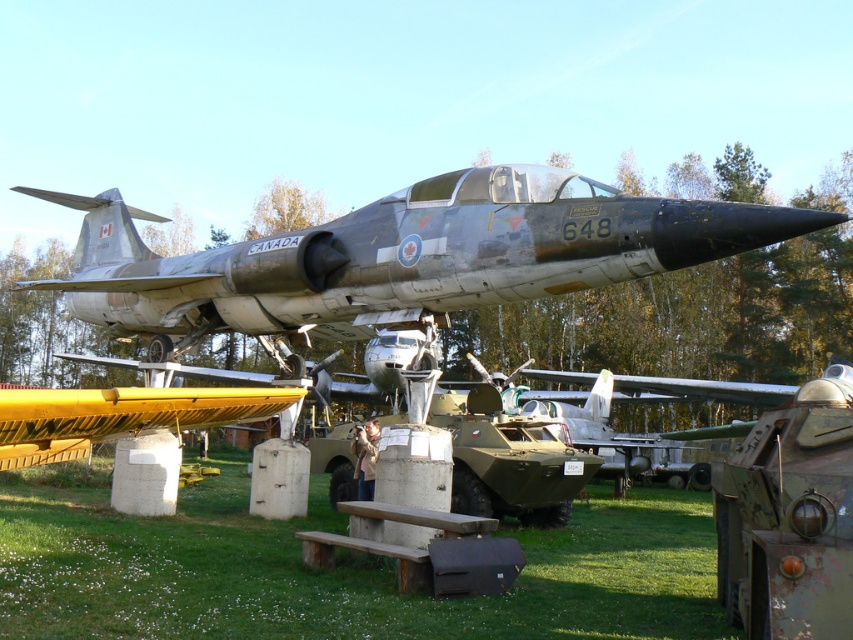
Question: Can you confirm if green grass at center is positioned to the right of camouflage paint fighter jet at center?

Choices:
 (A) no
 (B) yes

Answer: (A)

Question: Which point is farther to the camera?

Choices:
 (A) camouflage paint fighter jet at center
 (B) green grass at center

Answer: (A)

Question: From the image, what is the correct spatial relationship of green grass at center in relation to camouflage paint fighter jet at center?

Choices:
 (A) left
 (B) right

Answer: (A)

Question: Among these objects, which one is farthest from the camera?

Choices:
 (A) camouflage paint fighter jet at center
 (B) green grass at center

Answer: (A)

Question: Can you confirm if green grass at center is positioned to the left of camouflage paint fighter jet at center?

Choices:
 (A) yes
 (B) no

Answer: (A)